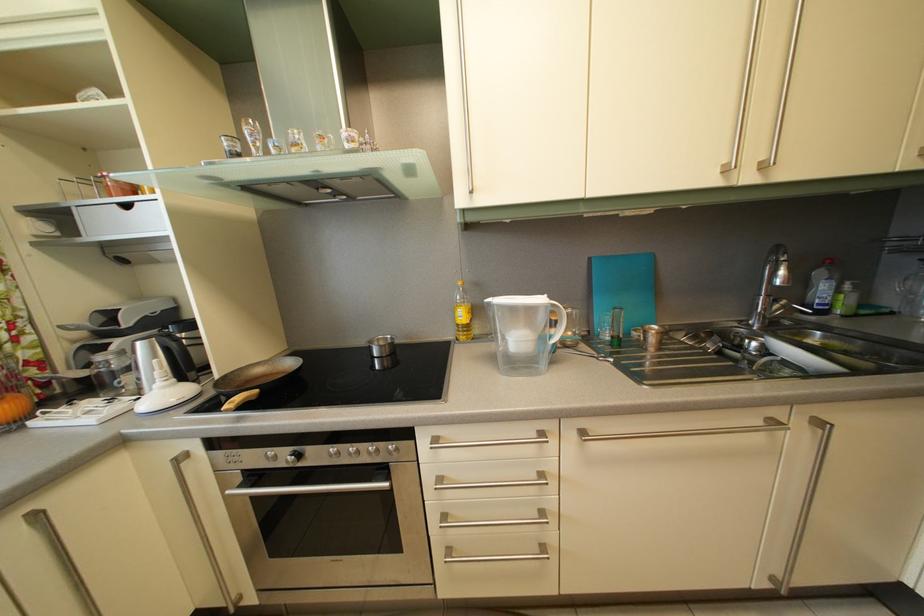
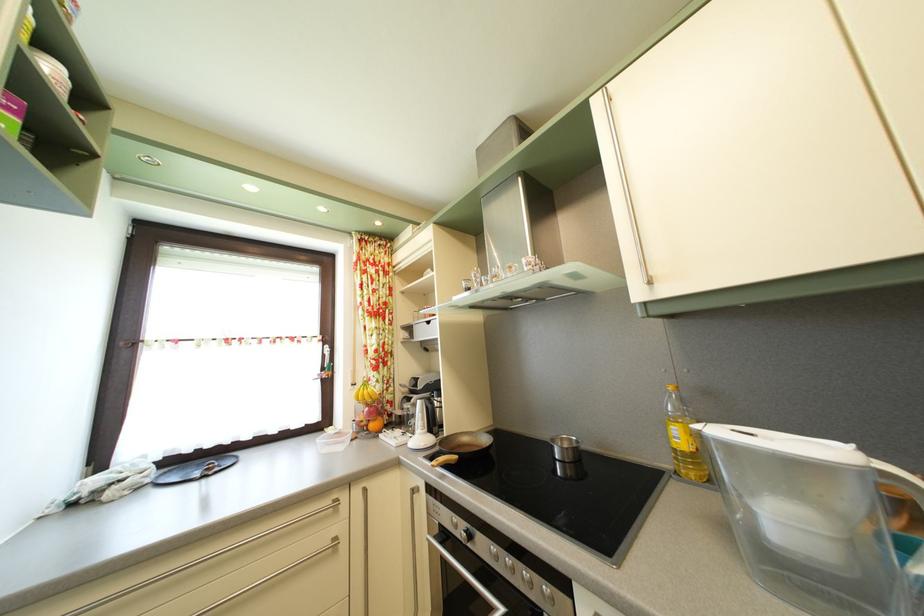
Where in the second image is the point corresponding to [390,453] from the first image?

(543, 585)